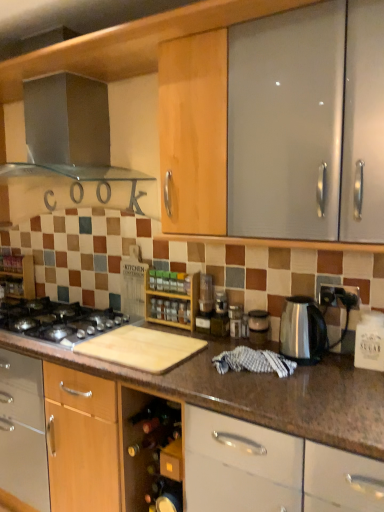
Measure the distance between wooden spice rack at center, the first shelf viewed from the right, and camera.

wooden spice rack at center, the first shelf viewed from the right, and camera are 1.97 meters apart from each other.

Describe the element at coordinates (172, 298) in the screenshot. I see `wooden spice rack at center, marked as the first shelf in a front-to-back arrangement` at that location.

The width and height of the screenshot is (384, 512). Describe the element at coordinates (66, 132) in the screenshot. I see `stainless steel range hood at upper left, which is the first kitchen appliance from left to right` at that location.

At what (x,y) coordinates should I click in order to perform the action: click on stainless steel kettle at right, positioned as the first kitchen appliance in front-to-back order. Please return your answer as a coordinate pair (x, y). The image size is (384, 512). Looking at the image, I should click on (302, 330).

Image resolution: width=384 pixels, height=512 pixels. What do you see at coordinates (220, 315) in the screenshot?
I see `metallic silver blender at center, positioned as the 2th appliance in right-to-left order` at bounding box center [220, 315].

I want to click on wooden spice rack at left, arranged as the second shelf when viewed from the right, so click(x=18, y=276).

Find the location of `gas stove on the left of wooden spice rack at center, the first shelf viewed from the right`. gas stove on the left of wooden spice rack at center, the first shelf viewed from the right is located at coordinates (59, 320).

Would you consider black matte gas stove at lower left to be distant from wooden spice rack at center, the 2th shelf in the back-to-front sequence?

black matte gas stove at lower left is actually quite close to wooden spice rack at center, the 2th shelf in the back-to-front sequence.

Looking at this image, considering the sizes of black matte gas stove at lower left and wooden spice rack at center, the 2th shelf in the back-to-front sequence, in the image, is black matte gas stove at lower left wider or thinner than wooden spice rack at center, the 2th shelf in the back-to-front sequence,?

Clearly, black matte gas stove at lower left has more width compared to wooden spice rack at center, the 2th shelf in the back-to-front sequence.

How many degrees apart are the facing directions of black matte gas stove at lower left and wooden spice rack at center, marked as the first shelf in a front-to-back arrangement?

The facing directions of black matte gas stove at lower left and wooden spice rack at center, marked as the first shelf in a front-to-back arrangement, are 1.04 degrees apart.

The image size is (384, 512). In order to click on shelf lying on the left of wooden spice rack at center, the 2th shelf in the back-to-front sequence in this screenshot , I will do `click(18, 276)`.

Is wooden spice rack at center, marked as the first shelf in a front-to-back arrangement, at the left side of wooden spice rack at left, positioned as the first shelf in back-to-front order?

In fact, wooden spice rack at center, marked as the first shelf in a front-to-back arrangement, is to the right of wooden spice rack at left, positioned as the first shelf in back-to-front order.

In terms of width, does wooden spice rack at center, the first shelf viewed from the right, look wider or thinner when compared to wooden spice rack at left, which appears as the first shelf when viewed from the left?

Clearly, wooden spice rack at center, the first shelf viewed from the right, has less width compared to wooden spice rack at left, which appears as the first shelf when viewed from the left.

Considering the positions of objects wooden spice rack at center, the first shelf viewed from the right, and wooden spice rack at left, positioned as the first shelf in back-to-front order, in the image provided, who is behind, wooden spice rack at center, the first shelf viewed from the right, or wooden spice rack at left, positioned as the first shelf in back-to-front order,?

wooden spice rack at left, positioned as the first shelf in back-to-front order, is further away from the camera.

Who is more distant, stainless steel range hood at upper left, which is counted as the 1th kitchen appliance, starting from the top, or wooden spice rack at center, marked as the first shelf in a front-to-back arrangement?

wooden spice rack at center, marked as the first shelf in a front-to-back arrangement, is further away from the camera.

Is stainless steel range hood at upper left, which is counted as the 1th kitchen appliance, starting from the top, aimed at wooden spice rack at center, the first shelf viewed from the right?

No.

Can you confirm if stainless steel range hood at upper left, which is counted as the 1th kitchen appliance, starting from the top, is positioned to the left of wooden spice rack at center, the first shelf viewed from the right?

Yes, stainless steel range hood at upper left, which is counted as the 1th kitchen appliance, starting from the top, is to the left of wooden spice rack at center, the first shelf viewed from the right.

Could you measure the distance between stainless steel range hood at upper left, acting as the second kitchen appliance starting from the right, and metallic silver blender at center, positioned as the 2th appliance in right-to-left order?

stainless steel range hood at upper left, acting as the second kitchen appliance starting from the right, is 3.68 feet away from metallic silver blender at center, positioned as the 2th appliance in right-to-left order.

Does stainless steel range hood at upper left, which is the first kitchen appliance from left to right, appear on the left side of metallic silver blender at center, positioned as the 2th appliance in right-to-left order?

Correct, you'll find stainless steel range hood at upper left, which is the first kitchen appliance from left to right, to the left of metallic silver blender at center, positioned as the 2th appliance in right-to-left order.

I want to click on kitchen appliance lying above the metallic silver blender at center, positioned as the 2th appliance in right-to-left order (from the image's perspective), so click(66, 132).

From the image's perspective, is stainless steel range hood at upper left, which is counted as the 1th kitchen appliance, starting from the top, beneath metallic silver blender at center, which ranks as the 1th appliance in left-to-right order?

No, from the image's perspective, stainless steel range hood at upper left, which is counted as the 1th kitchen appliance, starting from the top, is not beneath metallic silver blender at center, which ranks as the 1th appliance in left-to-right order.

Is black matte gas stove at lower left located outside stainless steel range hood at upper left, acting as the 1th kitchen appliance starting from the back?

Yes, black matte gas stove at lower left is located beyond the bounds of stainless steel range hood at upper left, acting as the 1th kitchen appliance starting from the back.

Are black matte gas stove at lower left and stainless steel range hood at upper left, which is the first kitchen appliance from left to right, beside each other?

They are not placed beside each other.

Is black matte gas stove at lower left facing towards stainless steel range hood at upper left, which is counted as the 1th kitchen appliance, starting from the top?

No, black matte gas stove at lower left does not turn towards stainless steel range hood at upper left, which is counted as the 1th kitchen appliance, starting from the top.

What's the angular difference between black matte gas stove at lower left and stainless steel range hood at upper left, which is the first kitchen appliance from left to right,'s facing directions?

The angular difference between black matte gas stove at lower left and stainless steel range hood at upper left, which is the first kitchen appliance from left to right, is 1.04 degrees.

Would you say black matte gas stove at lower left is part of wooden spice rack at center, the second shelf positioned from the left,'s contents?

No, black matte gas stove at lower left is located outside of wooden spice rack at center, the second shelf positioned from the left.

From the image's perspective, relative to black matte gas stove at lower left, is wooden spice rack at center, the 2th shelf in the back-to-front sequence, above or below?

wooden spice rack at center, the 2th shelf in the back-to-front sequence, is situated higher than black matte gas stove at lower left in the image.

Does wooden spice rack at center, marked as the first shelf in a front-to-back arrangement, come in front of black matte gas stove at lower left?

No, wooden spice rack at center, marked as the first shelf in a front-to-back arrangement, is further to the viewer.

This screenshot has height=512, width=384. In order to click on the 2nd shelf behind the transparent plastic container at center, which is counted as the 2th appliance, starting from the left, counting from the anchor's position in this screenshot , I will do `click(18, 276)`.

Considering the positions of objects transparent plastic container at center, which is the 1th appliance in right-to-left order, and wooden spice rack at left, acting as the second shelf starting from the front, in the image provided, who is more to the right, transparent plastic container at center, which is the 1th appliance in right-to-left order, or wooden spice rack at left, acting as the second shelf starting from the front,?

From the viewer's perspective, transparent plastic container at center, which is the 1th appliance in right-to-left order, appears more on the right side.

Is wooden spice rack at left, positioned as the first shelf in back-to-front order, inside transparent plastic container at center, which is counted as the 2th appliance, starting from the left?

Actually, wooden spice rack at left, positioned as the first shelf in back-to-front order, is outside transparent plastic container at center, which is counted as the 2th appliance, starting from the left.

From the image's perspective, between transparent plastic container at center, which is the 1th appliance in right-to-left order, and wooden spice rack at left, positioned as the first shelf in back-to-front order, who is located below?

From the image's view, transparent plastic container at center, which is the 1th appliance in right-to-left order, is below.

At what (x,y) coordinates should I click in order to perform the action: click on shelf that is the 1st object located behind the black matte gas stove at lower left. Please return your answer as a coordinate pair (x, y). The width and height of the screenshot is (384, 512). Looking at the image, I should click on (172, 298).

Where is `shelf on the right of the wooden spice rack at left, arranged as the second shelf when viewed from the right`? shelf on the right of the wooden spice rack at left, arranged as the second shelf when viewed from the right is located at coordinates (172, 298).

Estimate the real-world distances between objects in this image. Which object is further from wooden spice rack at center, the 2th shelf in the back-to-front sequence, stainless steel kettle at right, which ranks as the 1th kitchen appliance in bottom-to-top order, or metallic silver blender at center, positioned as the 2th appliance in right-to-left order?

Based on the image, stainless steel kettle at right, which ranks as the 1th kitchen appliance in bottom-to-top order, appears to be further to wooden spice rack at center, the 2th shelf in the back-to-front sequence.

Estimate the real-world distances between objects in this image. Which object is closer to transparent plastic container at center, which is counted as the 2th appliance, starting from the left, stainless steel kettle at right, positioned as the first kitchen appliance in front-to-back order, or black matte gas stove at lower left?

stainless steel kettle at right, positioned as the first kitchen appliance in front-to-back order, is closer to transparent plastic container at center, which is counted as the 2th appliance, starting from the left.

Which object lies further to the anchor point transparent plastic container at center, which is counted as the 2th appliance, starting from the left, wooden spice rack at center, marked as the first shelf in a front-to-back arrangement, or black matte gas stove at lower left?

black matte gas stove at lower left is positioned further to the anchor transparent plastic container at center, which is counted as the 2th appliance, starting from the left.

Estimate the real-world distances between objects in this image. Which object is further from metallic silver blender at center, which ranks as the 1th appliance in left-to-right order, wooden spice rack at left, acting as the second shelf starting from the front, or stainless steel range hood at upper left, acting as the second kitchen appliance starting from the right?

Among the two, wooden spice rack at left, acting as the second shelf starting from the front, is located further to metallic silver blender at center, which ranks as the 1th appliance in left-to-right order.

Which object lies further to the anchor point transparent plastic container at center, which is counted as the 2th appliance, starting from the left, wooden spice rack at left, positioned as the first shelf in back-to-front order, or metallic silver blender at center, which ranks as the 1th appliance in left-to-right order?

wooden spice rack at left, positioned as the first shelf in back-to-front order, is positioned further to the anchor transparent plastic container at center, which is counted as the 2th appliance, starting from the left.

Considering their positions, is metallic silver blender at center, which ranks as the 1th appliance in left-to-right order, positioned closer to transparent plastic container at center, which is counted as the 2th appliance, starting from the left, than stainless steel kettle at right, which ranks as the 1th kitchen appliance in bottom-to-top order?

metallic silver blender at center, which ranks as the 1th appliance in left-to-right order, lies closer to transparent plastic container at center, which is counted as the 2th appliance, starting from the left, than the other object.

Considering their positions, is metallic silver blender at center, positioned as the 2th appliance in right-to-left order, positioned further to stainless steel kettle at right, which ranks as the 2th kitchen appliance in back-to-front order, than wooden spice rack at left, acting as the second shelf starting from the front?

wooden spice rack at left, acting as the second shelf starting from the front, is further to stainless steel kettle at right, which ranks as the 2th kitchen appliance in back-to-front order.

Based on their spatial positions, is transparent plastic container at center, which is the 1th appliance in right-to-left order, or metallic silver blender at center, which ranks as the 1th appliance in left-to-right order, closer to wooden spice rack at center, the first shelf viewed from the right?

Among the two, metallic silver blender at center, which ranks as the 1th appliance in left-to-right order, is located nearer to wooden spice rack at center, the first shelf viewed from the right.

Where is `shelf between black matte gas stove at lower left and transparent plastic container at center, which is the 1th appliance in right-to-left order`? The height and width of the screenshot is (512, 384). shelf between black matte gas stove at lower left and transparent plastic container at center, which is the 1th appliance in right-to-left order is located at coordinates (172, 298).

Locate an element on the screen. gas stove between wooden spice rack at left, acting as the second shelf starting from the front, and metallic silver blender at center, which ranks as the 1th appliance in left-to-right order, from left to right is located at coordinates (59, 320).

The image size is (384, 512). I want to click on appliance that lies between stainless steel range hood at upper left, which appears as the second kitchen appliance when ordered from the bottom, and black matte gas stove at lower left from top to bottom, so click(x=220, y=315).

The height and width of the screenshot is (512, 384). I want to click on appliance located between wooden spice rack at center, marked as the first shelf in a front-to-back arrangement, and transparent plastic container at center, which is the 1th appliance in right-to-left order, in the left-right direction, so click(220, 315).